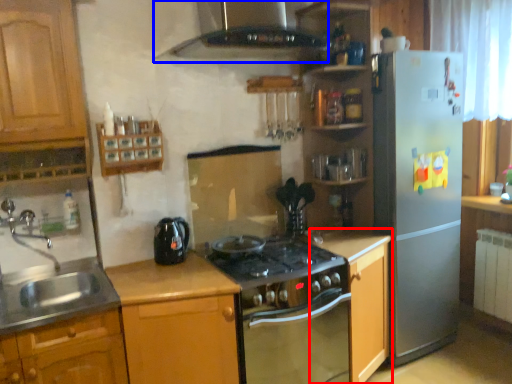
Question: Among these objects, which one is nearest to the camera, cabinetry (highlighted by a red box) or exhaust hood (highlighted by a blue box)?

Choices:
 (A) cabinetry
 (B) exhaust hood

Answer: (B)